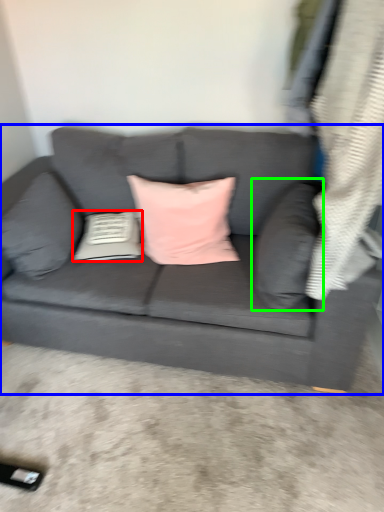
Question: Estimate the real-world distances between objects in this image. Which object is farther from pillow (highlighted by a red box), studio couch (highlighted by a blue box) or pillow (highlighted by a green box)?

Choices:
 (A) studio couch
 (B) pillow

Answer: (B)